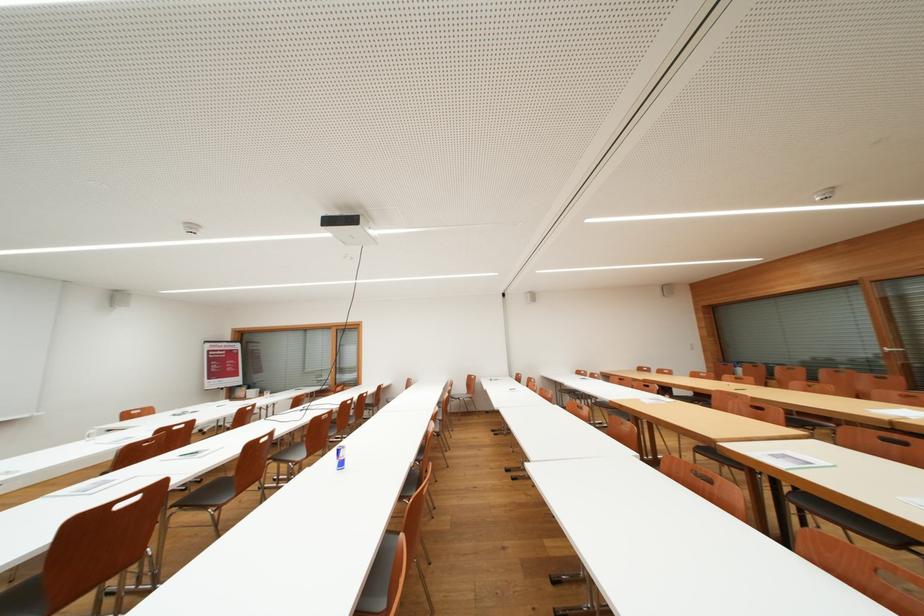
Where would you pull the window handle? Please return your answer as a coordinate pair (x, y).

(893, 350)